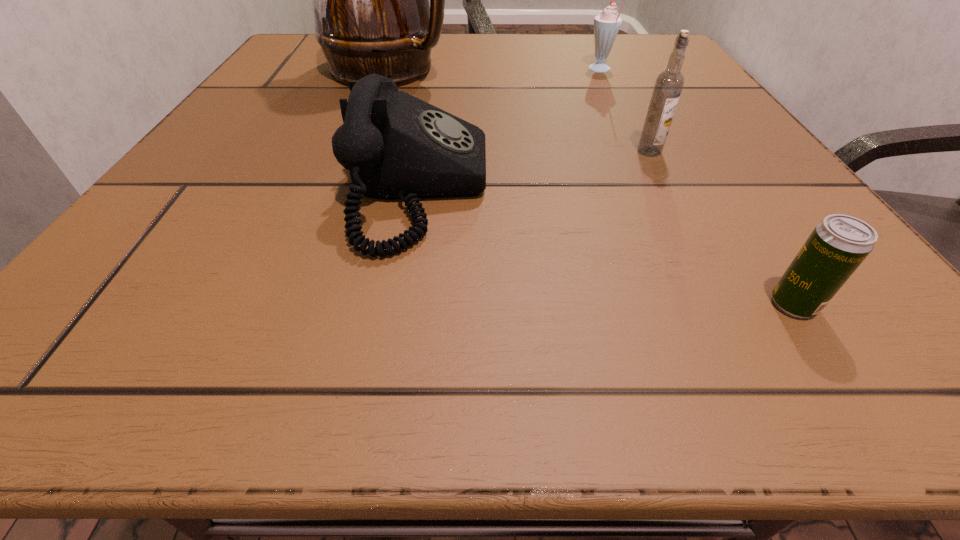
The width and height of the screenshot is (960, 540). Find the location of `object that is the third closest to the telephone`. object that is the third closest to the telephone is located at coordinates (837, 246).

The image size is (960, 540). In order to click on free region that satisfies the following two spatial constraints: 1. on the dial of the beer can; 2. on the right side of the telephone in this screenshot , I will do `click(400, 304)`.

Where is `vacant space that satisfies the following two spatial constraints: 1. on the label of the second tallest object; 2. on the dial of the telephone`? This screenshot has width=960, height=540. vacant space that satisfies the following two spatial constraints: 1. on the label of the second tallest object; 2. on the dial of the telephone is located at coordinates (669, 190).